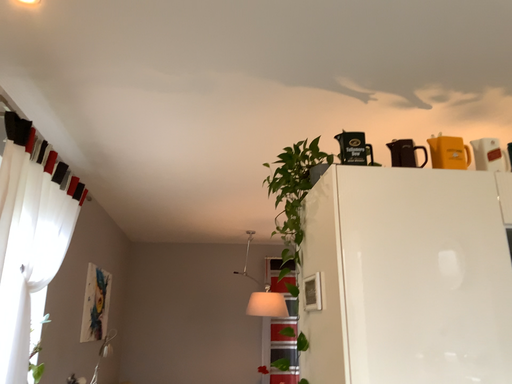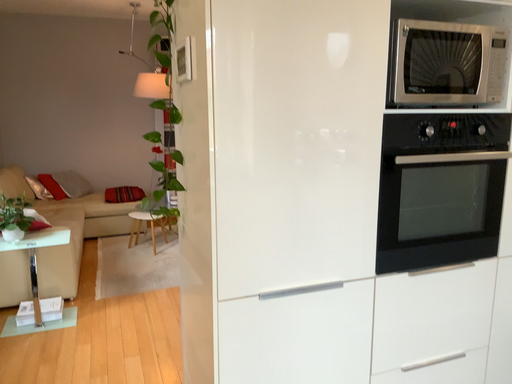
Question: Which way did the camera rotate in the video?

Choices:
 (A) rotated left
 (B) rotated right

Answer: (B)